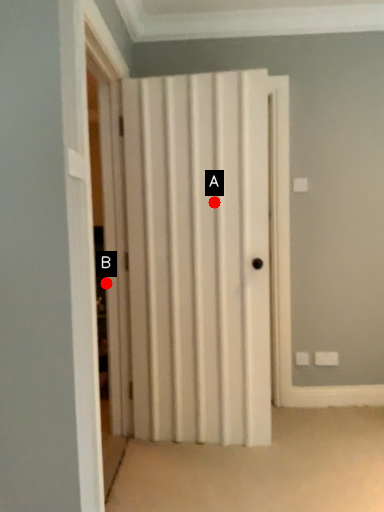
Question: Two points are circled on the image, labeled by A and B beside each circle. Which point is closer to the camera taking this photo?

Choices:
 (A) A is closer
 (B) B is closer

Answer: (A)